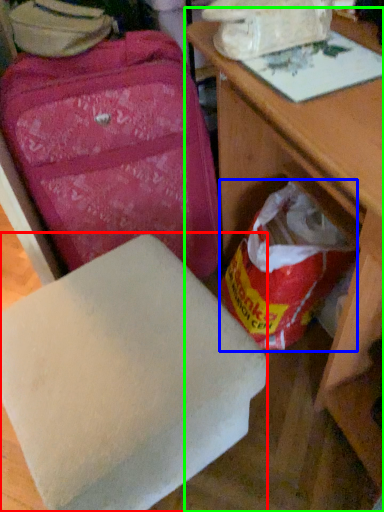
Question: Based on their relative distances, which object is farther from furniture (highlighted by a red box)? Choose from grocery bag (highlighted by a blue box) and table (highlighted by a green box).

Choices:
 (A) grocery bag
 (B) table

Answer: (A)